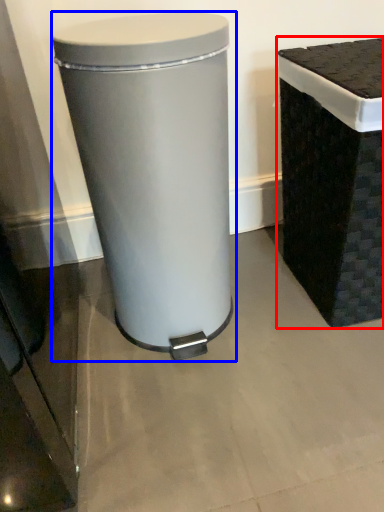
Question: Which of the following is the farthest to the observer, waste container (highlighted by a red box) or waste container (highlighted by a blue box)?

Choices:
 (A) waste container
 (B) waste container

Answer: (A)